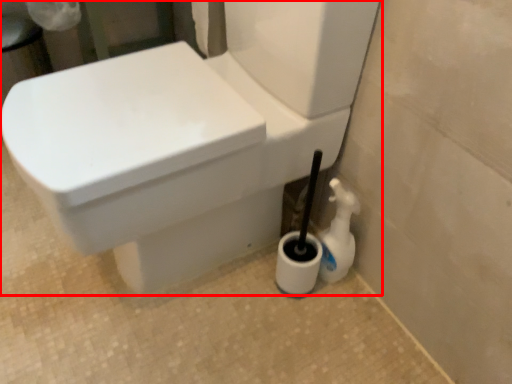
Question: From the image, what is the correct spatial relationship of toilet (annotated by the red box) in relation to cleaning product?

Choices:
 (A) left
 (B) right

Answer: (A)